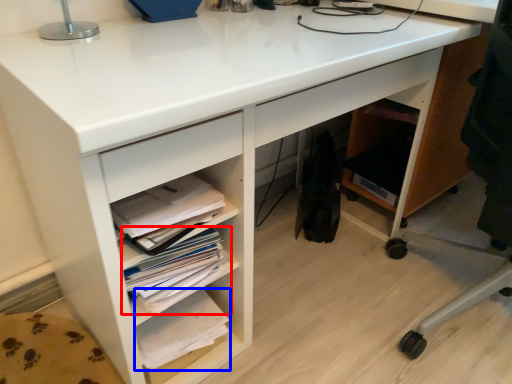
Question: Which of the following is the farthest to the observer, book (highlighted by a red box) or book (highlighted by a blue box)?

Choices:
 (A) book
 (B) book

Answer: (B)